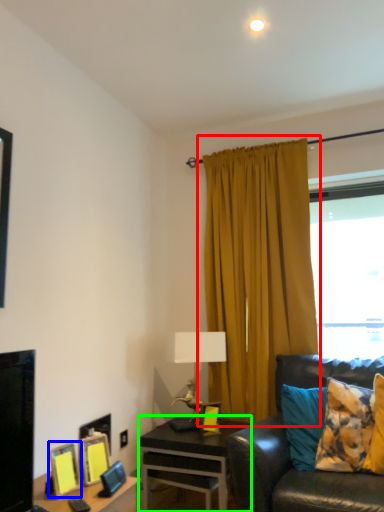
Question: Considering the real-world distances, which object is farthest from curtain (highlighted by a red box)? picture frame (highlighted by a blue box) or desk (highlighted by a green box)?

Choices:
 (A) picture frame
 (B) desk

Answer: (A)